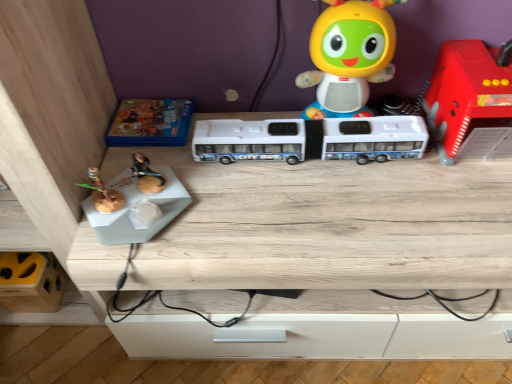
The height and width of the screenshot is (384, 512). I want to click on free space below white plastic bus at center, acting as the third toy starting from the right (from a real-world perspective), so click(x=316, y=153).